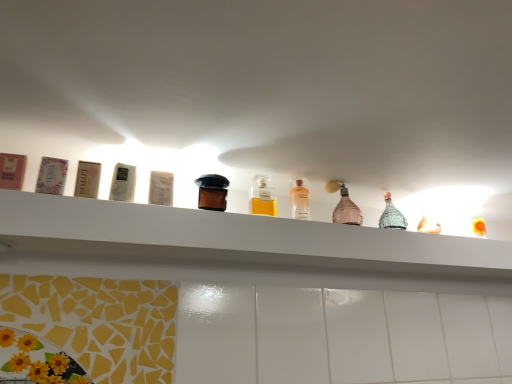
I want to click on white glossy shelf at upper center, so click(236, 238).

The height and width of the screenshot is (384, 512). What do you see at coordinates (262, 197) in the screenshot?
I see `yellow glass bottle at center, placed as the second bottle when sorted from left to right` at bounding box center [262, 197].

The image size is (512, 384). Describe the element at coordinates (212, 192) in the screenshot. I see `brown glass bottle at center, placed as the first bottle when sorted from left to right` at that location.

Identify the location of clear glass bottle at center, placed as the second bottle when sorted from right to left. This screenshot has width=512, height=384. (300, 200).

Is yellow glass bottle at center, which is the 3th bottle from right to left, positioned with its back to clear glass bottle at center, positioned as the 3th bottle in left-to-right order?

No.

Which object is wider, yellow glass bottle at center, placed as the second bottle when sorted from left to right, or clear glass bottle at center, positioned as the 3th bottle in left-to-right order?

Wider between the two is clear glass bottle at center, positioned as the 3th bottle in left-to-right order.

Can you confirm if yellow glass bottle at center, which is the 3th bottle from right to left, is shorter than clear glass bottle at center, positioned as the 3th bottle in left-to-right order?

Yes.

Measure the distance between clear glass bottle at center, positioned as the 3th bottle in left-to-right order, and pink matte bottle at center, placed as the fourth bottle when sorted from left to right.

A distance of 3.96 inches exists between clear glass bottle at center, positioned as the 3th bottle in left-to-right order, and pink matte bottle at center, placed as the fourth bottle when sorted from left to right.

Which of these two, clear glass bottle at center, placed as the second bottle when sorted from right to left, or pink matte bottle at center, the 1th bottle when ordered from right to left, is bigger?

With larger size is pink matte bottle at center, the 1th bottle when ordered from right to left.

Locate an element on the screen. This screenshot has width=512, height=384. bottle below the clear glass bottle at center, placed as the second bottle when sorted from right to left (from the image's perspective) is located at coordinates 344,205.

Is the position of clear glass bottle at center, placed as the second bottle when sorted from right to left, less distant than that of pink matte bottle at center, placed as the fourth bottle when sorted from left to right?

Yes, the depth of clear glass bottle at center, placed as the second bottle when sorted from right to left, is less than that of pink matte bottle at center, placed as the fourth bottle when sorted from left to right.

Considering the positions of points (350, 200) and (202, 191), is point (350, 200) farther from camera compared to point (202, 191)?

Yes, it is behind point (202, 191).

Is pink matte bottle at center, placed as the fourth bottle when sorted from left to right, completely or partially outside of brown glass bottle at center, the 4th bottle viewed from the right?

Yes, pink matte bottle at center, placed as the fourth bottle when sorted from left to right, is not within brown glass bottle at center, the 4th bottle viewed from the right.

Considering the relative sizes of pink matte bottle at center, the 1th bottle when ordered from right to left, and brown glass bottle at center, placed as the first bottle when sorted from left to right, in the image provided, is pink matte bottle at center, the 1th bottle when ordered from right to left, taller than brown glass bottle at center, placed as the first bottle when sorted from left to right,?

Indeed, pink matte bottle at center, the 1th bottle when ordered from right to left, has a greater height compared to brown glass bottle at center, placed as the first bottle when sorted from left to right.

Based on the photo, how distant is pink matte bottle at center, placed as the fourth bottle when sorted from left to right, from brown glass bottle at center, placed as the first bottle when sorted from left to right?

A distance of 32.93 centimeters exists between pink matte bottle at center, placed as the fourth bottle when sorted from left to right, and brown glass bottle at center, placed as the first bottle when sorted from left to right.

Is white glossy shelf at upper center at the back of pink matte bottle at center, the 1th bottle when ordered from right to left?

That's not correct — pink matte bottle at center, the 1th bottle when ordered from right to left, is not looking away from white glossy shelf at upper center.

Find the location of a particular element. This screenshot has height=384, width=512. shelf lying below the pink matte bottle at center, the 1th bottle when ordered from right to left (from the image's perspective) is located at coordinates (236, 238).

Can you see pink matte bottle at center, placed as the fourth bottle when sorted from left to right, touching white glossy shelf at upper center?

No, pink matte bottle at center, placed as the fourth bottle when sorted from left to right, is not with white glossy shelf at upper center.

Could you tell me if yellow glass bottle at center, placed as the second bottle when sorted from left to right, is facing white glossy shelf at upper center?

No.

From a real-world perspective, does yellow glass bottle at center, which is the 3th bottle from right to left, stand above white glossy shelf at upper center?

Indeed, from a real-world perspective, yellow glass bottle at center, which is the 3th bottle from right to left, stands above white glossy shelf at upper center.

Is yellow glass bottle at center, which is the 3th bottle from right to left, to the left of white glossy shelf at upper center from the viewer's perspective?

Yes.

Consider the image. Is white glossy shelf at upper center in front of or behind yellow glass bottle at center, placed as the second bottle when sorted from left to right, in the image?

white glossy shelf at upper center is in front of yellow glass bottle at center, placed as the second bottle when sorted from left to right.

Does white glossy shelf at upper center have a lesser width compared to yellow glass bottle at center, placed as the second bottle when sorted from left to right?

In fact, white glossy shelf at upper center might be wider than yellow glass bottle at center, placed as the second bottle when sorted from left to right.

From the image's perspective, between white glossy shelf at upper center and yellow glass bottle at center, which is the 3th bottle from right to left, which one is located above?

yellow glass bottle at center, which is the 3th bottle from right to left, from the image's perspective.

Who is smaller, clear glass bottle at center, positioned as the 3th bottle in left-to-right order, or yellow glass bottle at center, which is the 3th bottle from right to left?

Smaller between the two is yellow glass bottle at center, which is the 3th bottle from right to left.

Who is more distant, clear glass bottle at center, placed as the second bottle when sorted from right to left, or yellow glass bottle at center, which is the 3th bottle from right to left?

clear glass bottle at center, placed as the second bottle when sorted from right to left, is further away from the camera.

Between clear glass bottle at center, positioned as the 3th bottle in left-to-right order, and yellow glass bottle at center, placed as the second bottle when sorted from left to right, which one has less height?

With less height is yellow glass bottle at center, placed as the second bottle when sorted from left to right.

Which is further, [293,198] or [269,214]?

The point [293,198] is more distant.

Find the location of a particular element. the 1st bottle behind the yellow glass bottle at center, placed as the second bottle when sorted from left to right is located at coordinates (300, 200).

Which bottle is the 1st one when counting from the left side of the pink matte bottle at center, the 1th bottle when ordered from right to left? Please provide its 2D coordinates.

[(300, 200)]

In the scene shown: Looking at the image, which one is located closer to brown glass bottle at center, placed as the first bottle when sorted from left to right, white glossy shelf at upper center or yellow glass bottle at center, which is the 3th bottle from right to left?

yellow glass bottle at center, which is the 3th bottle from right to left, is positioned closer to the anchor brown glass bottle at center, placed as the first bottle when sorted from left to right.

From the image, which object appears to be farther from yellow glass bottle at center, placed as the second bottle when sorted from left to right, white glossy shelf at upper center or pink matte bottle at center, placed as the fourth bottle when sorted from left to right?

white glossy shelf at upper center.

From the image, which object appears to be nearer to white glossy shelf at upper center, yellow glass bottle at center, placed as the second bottle when sorted from left to right, or clear glass bottle at center, positioned as the 3th bottle in left-to-right order?

yellow glass bottle at center, placed as the second bottle when sorted from left to right, lies closer to white glossy shelf at upper center than the other object.

From the image, which object appears to be nearer to pink matte bottle at center, placed as the fourth bottle when sorted from left to right, white glossy shelf at upper center or brown glass bottle at center, placed as the first bottle when sorted from left to right?

Among the two, white glossy shelf at upper center is located nearer to pink matte bottle at center, placed as the fourth bottle when sorted from left to right.

Estimate the real-world distances between objects in this image. Which object is further from white glossy shelf at upper center, brown glass bottle at center, the 4th bottle viewed from the right, or yellow glass bottle at center, placed as the second bottle when sorted from left to right?

brown glass bottle at center, the 4th bottle viewed from the right.

When comparing their distances from clear glass bottle at center, positioned as the 3th bottle in left-to-right order, does yellow glass bottle at center, placed as the second bottle when sorted from left to right, or brown glass bottle at center, placed as the first bottle when sorted from left to right, seem closer?

The object closer to clear glass bottle at center, positioned as the 3th bottle in left-to-right order, is yellow glass bottle at center, placed as the second bottle when sorted from left to right.

From the image, which object appears to be nearer to brown glass bottle at center, placed as the first bottle when sorted from left to right, white glossy shelf at upper center or clear glass bottle at center, positioned as the 3th bottle in left-to-right order?

clear glass bottle at center, positioned as the 3th bottle in left-to-right order.

Looking at this image, estimate the real-world distances between objects in this image. Which object is further from white glossy shelf at upper center, clear glass bottle at center, positioned as the 3th bottle in left-to-right order, or brown glass bottle at center, the 4th bottle viewed from the right?

clear glass bottle at center, positioned as the 3th bottle in left-to-right order, lies further to white glossy shelf at upper center than the other object.

The height and width of the screenshot is (384, 512). Find the location of `bottle between yellow glass bottle at center, placed as the second bottle when sorted from left to right, and pink matte bottle at center, the 1th bottle when ordered from right to left, from left to right`. bottle between yellow glass bottle at center, placed as the second bottle when sorted from left to right, and pink matte bottle at center, the 1th bottle when ordered from right to left, from left to right is located at coordinates (300, 200).

The height and width of the screenshot is (384, 512). I want to click on bottle located between brown glass bottle at center, placed as the first bottle when sorted from left to right, and clear glass bottle at center, positioned as the 3th bottle in left-to-right order, in the left-right direction, so click(x=262, y=197).

Locate an element on the screen. The image size is (512, 384). bottle located between white glossy shelf at upper center and yellow glass bottle at center, placed as the second bottle when sorted from left to right, in the depth direction is located at coordinates (212, 192).